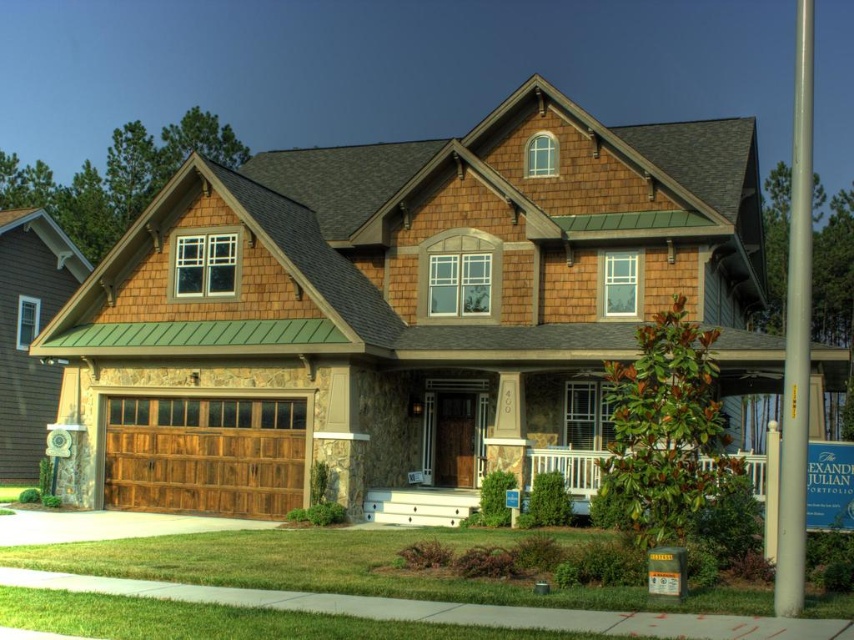
Question: Is wooden garage door at left further to camera compared to wooden at left?

Choices:
 (A) yes
 (B) no

Answer: (B)

Question: Which is nearer to the wooden garage door at left?

Choices:
 (A) wooden at left
 (B) white stone porch at center

Answer: (A)

Question: Does wooden garage door at left have a lesser width compared to wooden at left?

Choices:
 (A) no
 (B) yes

Answer: (A)

Question: Is wooden at left closer to the viewer compared to white stone porch at center?

Choices:
 (A) no
 (B) yes

Answer: (A)

Question: Which of these objects is positioned closest to the white stone porch at center?

Choices:
 (A) wooden garage door at left
 (B) wooden at left

Answer: (B)

Question: Based on their relative distances, which object is farther from the wooden garage door at left?

Choices:
 (A) white stone porch at center
 (B) wooden at left

Answer: (A)